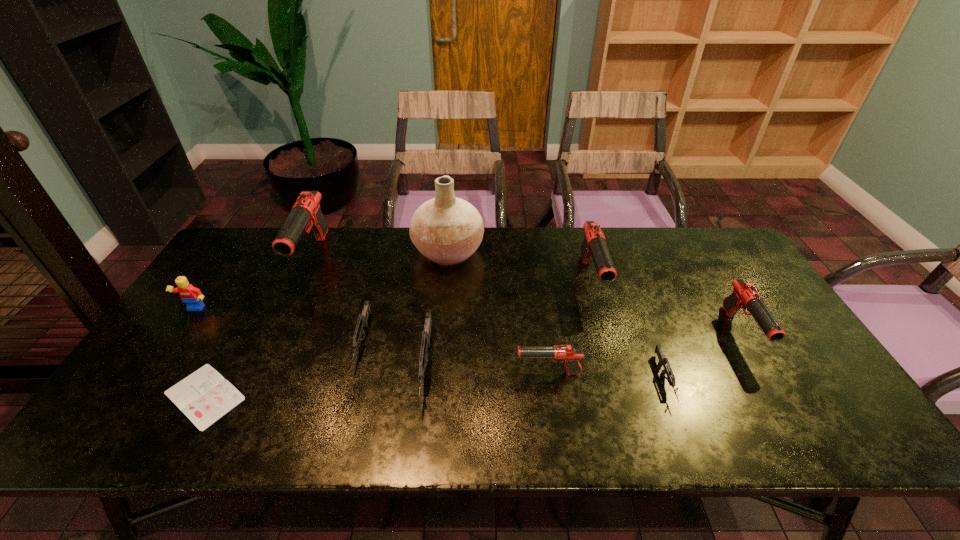
The height and width of the screenshot is (540, 960). Find the location of `free spot that satisfies the following two spatial constraints: 1. to pour from the handle of the pottery; 2. on the face of the yellow Lego`. free spot that satisfies the following two spatial constraints: 1. to pour from the handle of the pottery; 2. on the face of the yellow Lego is located at coordinates (443, 310).